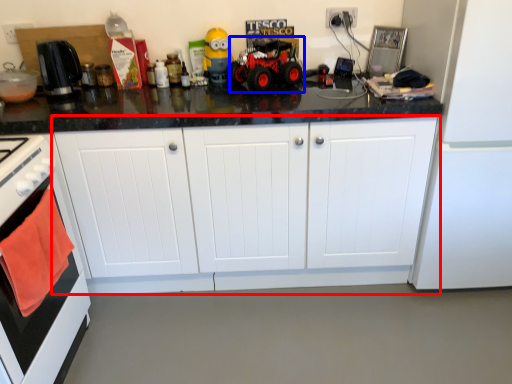
Question: Which of the following is the closest to the observer, cabinetry (highlighted by a red box) or toy car (highlighted by a blue box)?

Choices:
 (A) cabinetry
 (B) toy car

Answer: (A)